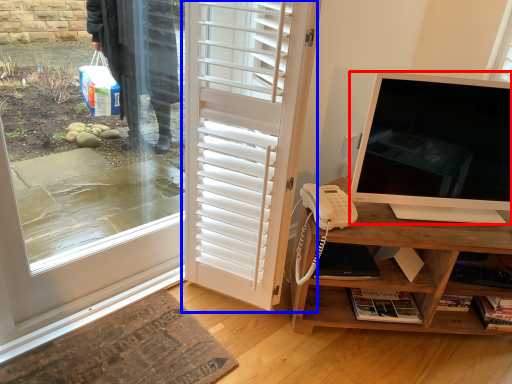
Question: Which object is further to the camera taking this photo, television (highlighted by a red box) or door (highlighted by a blue box)?

Choices:
 (A) television
 (B) door

Answer: (A)